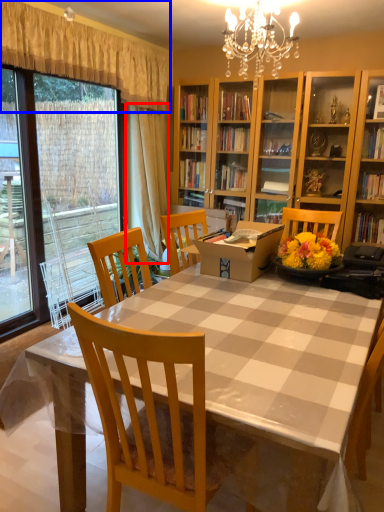
Question: Which point is further to the camera, curtain (highlighted by a red box) or curtain (highlighted by a blue box)?

Choices:
 (A) curtain
 (B) curtain

Answer: (A)